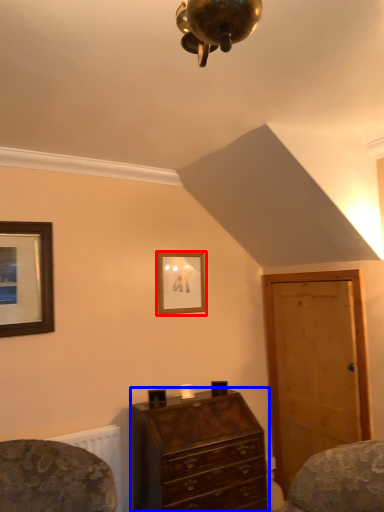
Question: Which object is closer to the camera taking this photo, picture frame (highlighted by a red box) or chest of drawers (highlighted by a blue box)?

Choices:
 (A) picture frame
 (B) chest of drawers

Answer: (B)